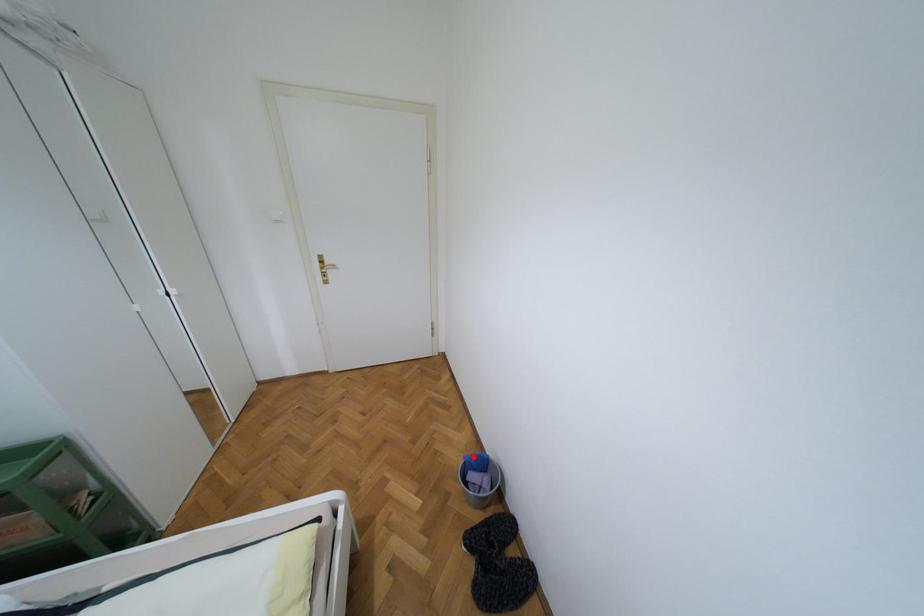
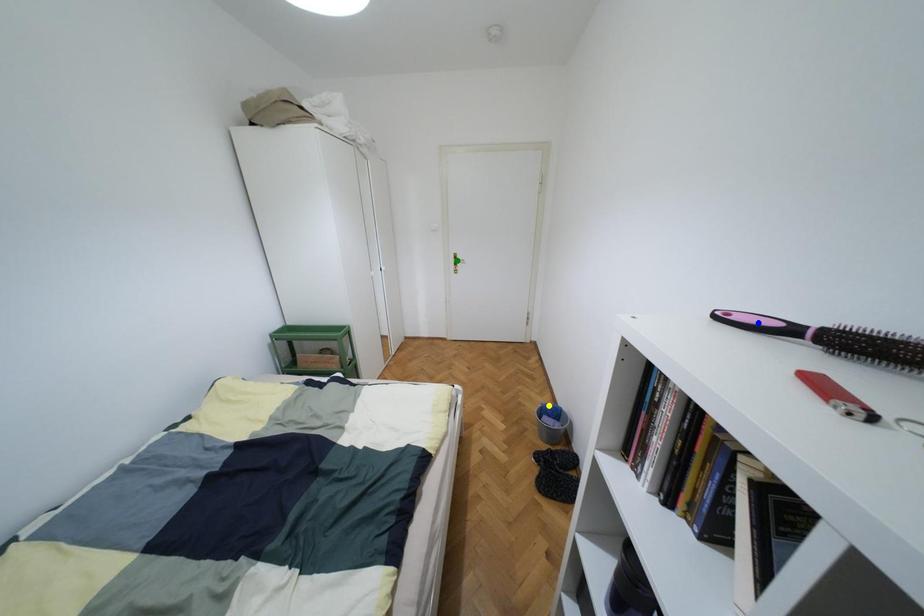
Question: I am providing you with two images of the same scene from different viewpoints. A red point is marked on the first image. You are given multiple points on the second image. Which mark in image 2 goes with the point in image 1?

Choices:
 (A) yellow point
 (B) green point
 (C) blue point

Answer: (A)